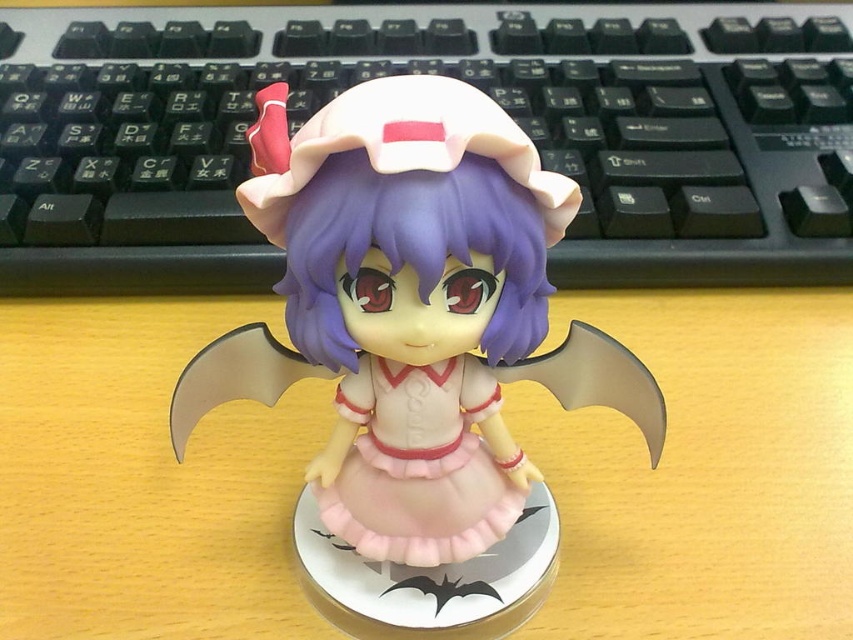
Is black plastic keyboard at center to the left of matte pink plastic figurine at center from the viewer's perspective?

In fact, black plastic keyboard at center is to the right of matte pink plastic figurine at center.

Is point (276, 268) closer to viewer compared to point (398, 291)?

No, it is not.

The width and height of the screenshot is (853, 640). I want to click on black plastic keyboard at center, so click(430, 72).

Who is more distant from viewer, (x=96, y=449) or (x=476, y=465)?

The point (x=96, y=449) is more distant.

Can you confirm if wooden table at center is wider than pink satin dress at center?

Yes.

This screenshot has width=853, height=640. What do you see at coordinates (705, 472) in the screenshot? I see `wooden table at center` at bounding box center [705, 472].

Locate an element on the screen. wooden table at center is located at coordinates (705, 472).

Consider the image. Does wooden table at center have a lesser height compared to matte pink plastic figurine at center?

Yes.

Which is more to the right, wooden table at center or matte pink plastic figurine at center?

wooden table at center is more to the right.

This screenshot has width=853, height=640. Describe the element at coordinates (705, 472) in the screenshot. I see `wooden table at center` at that location.

Identify the location of wooden table at center. (705, 472).